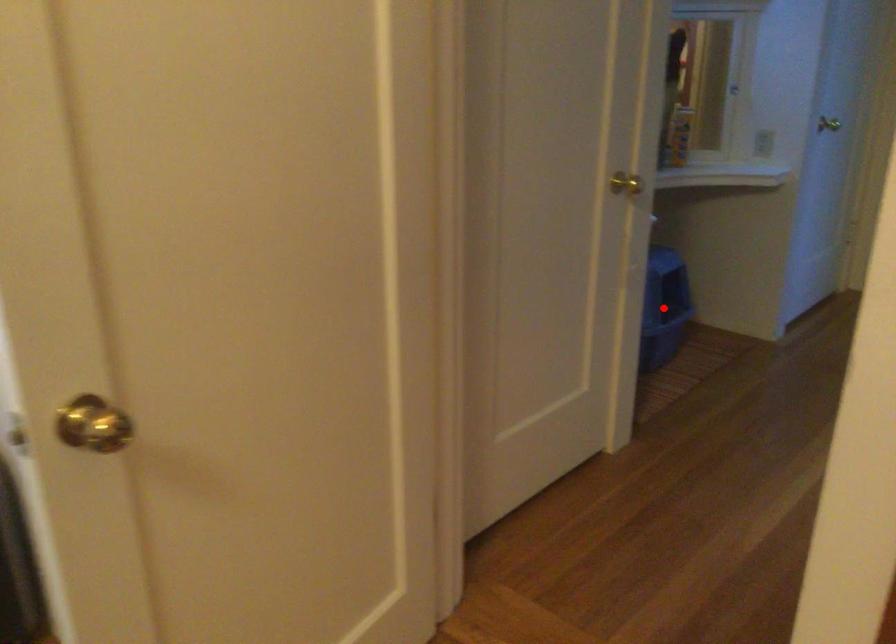
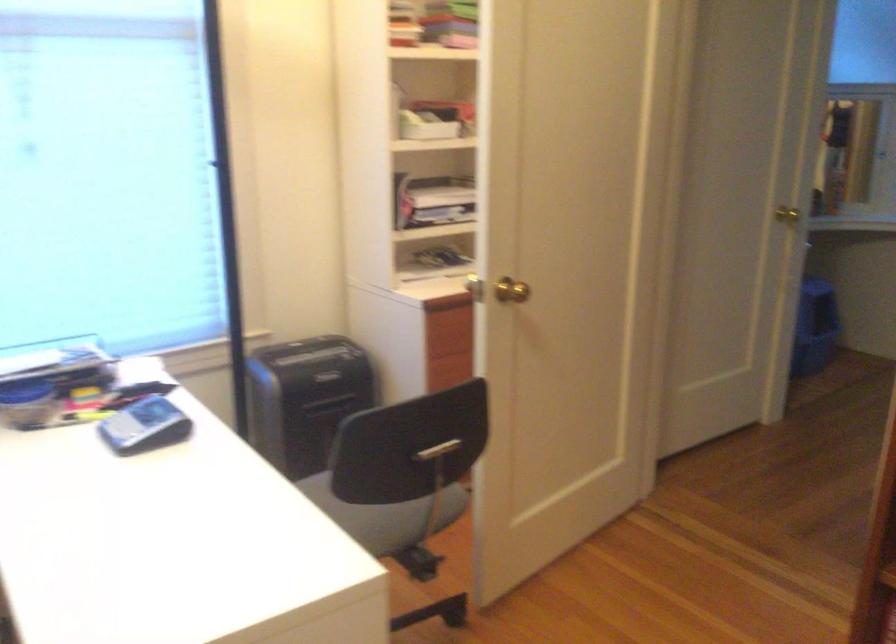
Find the pixel in the second image that matches the highlighted location in the first image.

(821, 333)